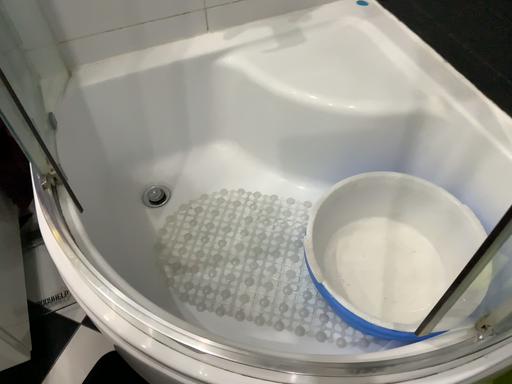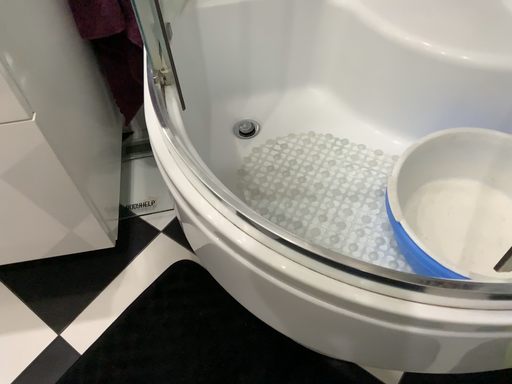
Question: How did the camera likely rotate when shooting the video?

Choices:
 (A) rotated right
 (B) rotated left

Answer: (B)